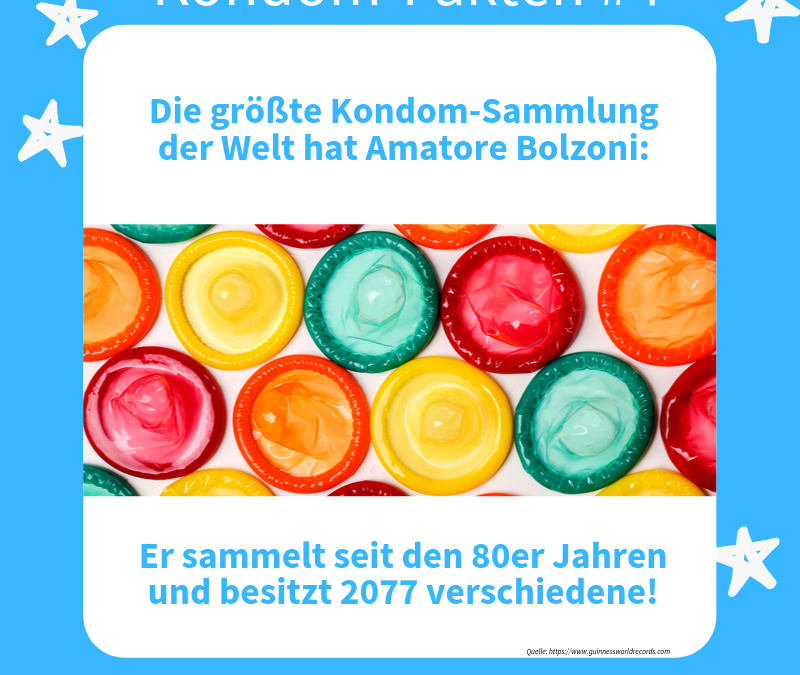
Locate an element on the screen. Image resolution: width=800 pixels, height=675 pixels. empty space below picture is located at coordinates (400, 518).